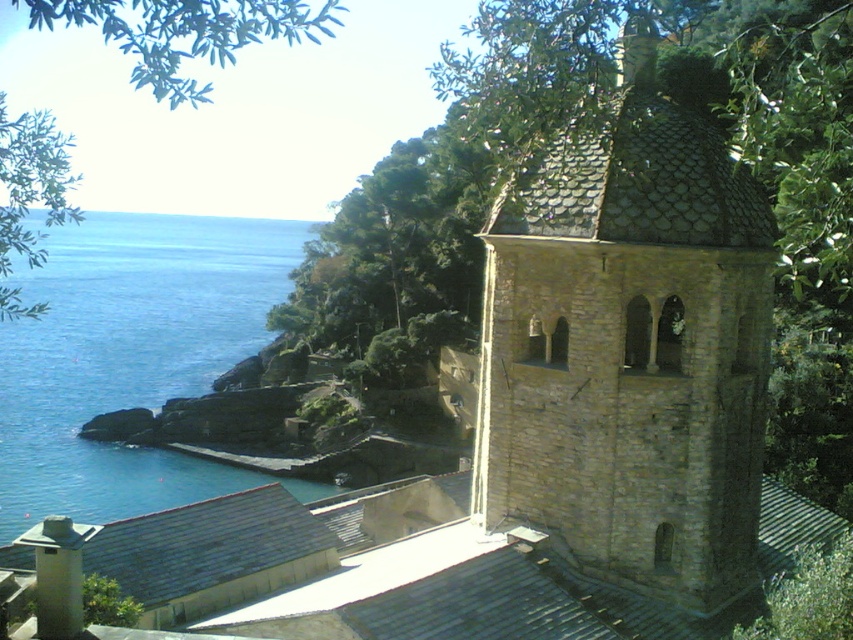
Does brown stone church tower at center have a larger size compared to blue water at lower left?

Actually, brown stone church tower at center might be smaller than blue water at lower left.

Does brown stone church tower at center appear under blue water at lower left?

Indeed, brown stone church tower at center is positioned under blue water at lower left.

Is point (509, 209) more distant than point (260, 230)?

That is False.

This screenshot has height=640, width=853. Identify the location of brown stone church tower at center. (630, 349).